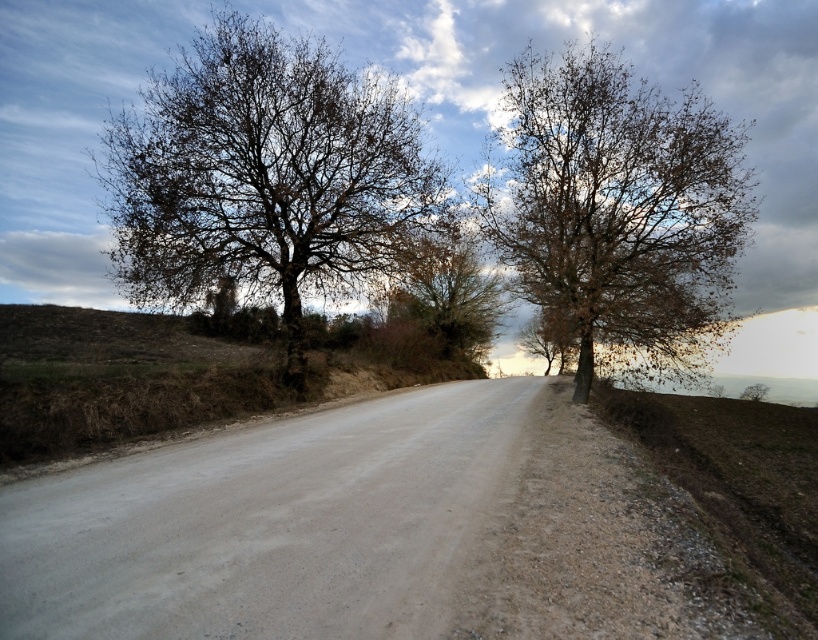
You are a hiker trying to decide between taking the gray gravel road at center or the brown grassy hill at lower left. Which path is narrower?

The gray gravel road at center has a smaller size compared to brown grassy hill at lower left, so the gray gravel road at center is narrower.

You are a hiker planning to cross the gray gravel road at center while avoiding the brown leafy tree at left. What is the minimum distance you need to walk to safely go around it?

The minimum distance you need to walk to safely go around the brown leafy tree at left is 33.90 feet, which is the distance between the gray gravel road at center and the brown leafy tree at left.

You are standing at the base of the brown grassy hill at lower left and want to walk down to the gray gravel road at center. Is the path going to be uphill or downhill?

The gray gravel road at center is below the brown grassy hill at lower left, so walking down from the brown grassy hill at lower left to the gray gravel road at center would be going downhill.